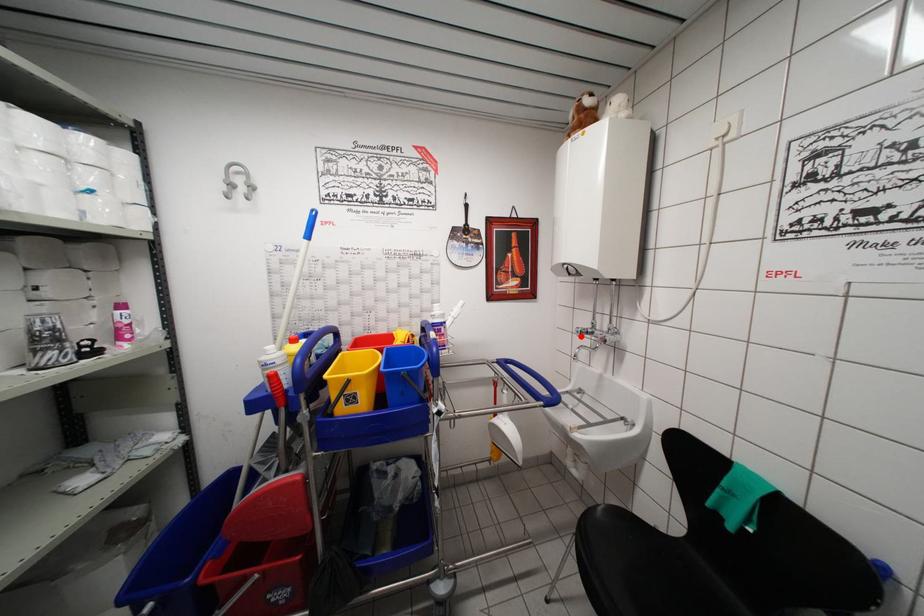
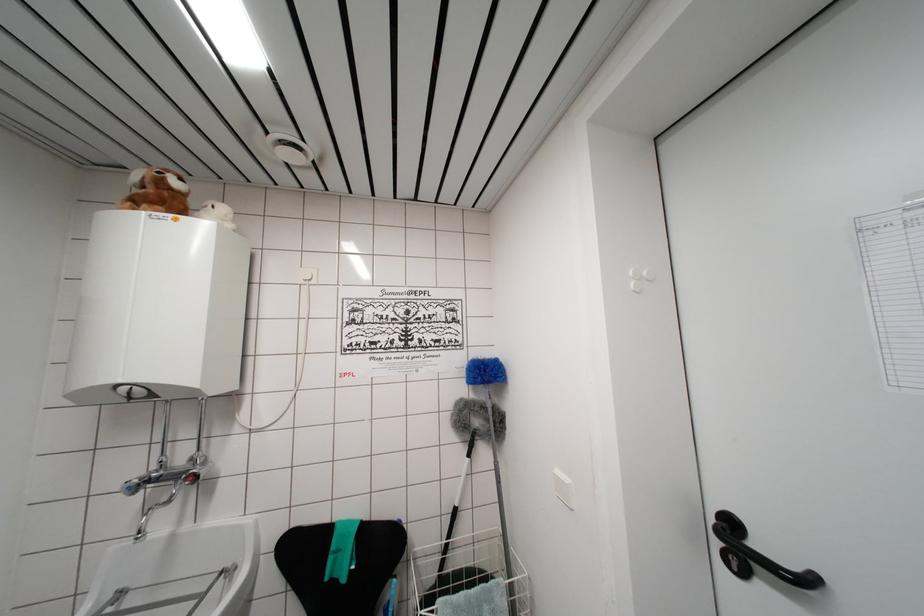
The point at the highlighted location is marked in the first image. Where is the corresponding point in the second image?

(132, 493)